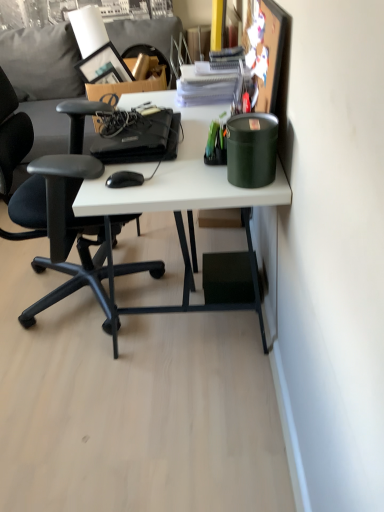
Question: From the image's perspective, is dark gray fabric couch at upper left on top of black plastic mouse at center?

Choices:
 (A) no
 (B) yes

Answer: (B)

Question: Is dark gray fabric couch at upper left in front of black plastic mouse at center?

Choices:
 (A) no
 (B) yes

Answer: (A)

Question: From a real-world perspective, is dark gray fabric couch at upper left over black plastic mouse at center?

Choices:
 (A) yes
 (B) no

Answer: (B)

Question: Is the position of dark gray fabric couch at upper left more distant than that of black plastic mouse at center?

Choices:
 (A) no
 (B) yes

Answer: (B)

Question: Is dark gray fabric couch at upper left smaller than black plastic mouse at center?

Choices:
 (A) no
 (B) yes

Answer: (A)

Question: Does dark gray fabric couch at upper left appear on the right side of black plastic mouse at center?

Choices:
 (A) yes
 (B) no

Answer: (B)

Question: Does white matte desk at center have a larger size compared to black plastic mouse at center?

Choices:
 (A) no
 (B) yes

Answer: (B)

Question: Can you confirm if white matte desk at center is smaller than black plastic mouse at center?

Choices:
 (A) yes
 (B) no

Answer: (B)

Question: From a real-world perspective, is white matte desk at center beneath black plastic mouse at center?

Choices:
 (A) yes
 (B) no

Answer: (A)

Question: Is white matte desk at center closer to camera compared to black plastic mouse at center?

Choices:
 (A) no
 (B) yes

Answer: (B)

Question: From the image's perspective, is white matte desk at center beneath black plastic mouse at center?

Choices:
 (A) yes
 (B) no

Answer: (A)

Question: Is white matte desk at center further to the viewer compared to black plastic mouse at center?

Choices:
 (A) no
 (B) yes

Answer: (A)

Question: Can you confirm if black plastic mouse at center is bigger than green matte canister at upper right?

Choices:
 (A) yes
 (B) no

Answer: (B)